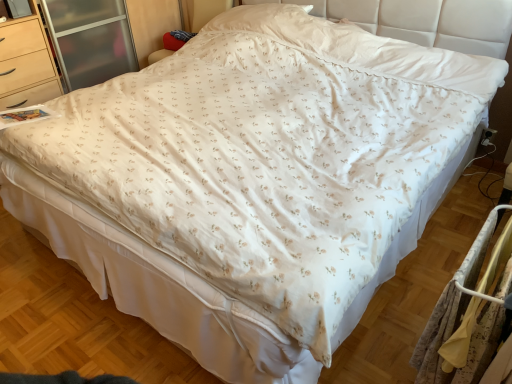
In order to click on floral cotton blanket at lower right in this screenshot , I will do `click(468, 311)`.

The height and width of the screenshot is (384, 512). Describe the element at coordinates (468, 311) in the screenshot. I see `floral cotton blanket at lower right` at that location.

Where is `floral cotton blanket at lower right`? This screenshot has width=512, height=384. floral cotton blanket at lower right is located at coordinates (468, 311).